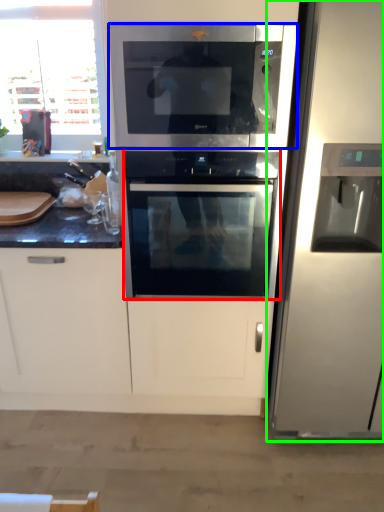
Question: Which object is positioned farthest from oven (highlighted by a red box)? Select from microwave oven (highlighted by a blue box) and refrigerator (highlighted by a green box).

Choices:
 (A) microwave oven
 (B) refrigerator

Answer: (B)